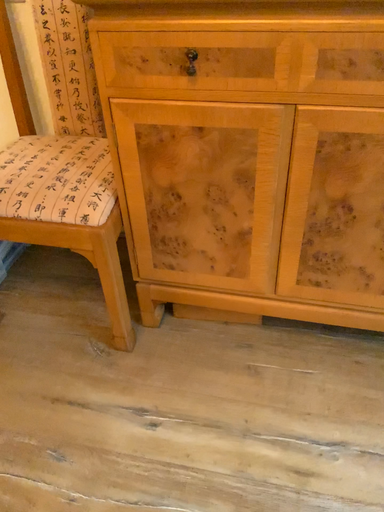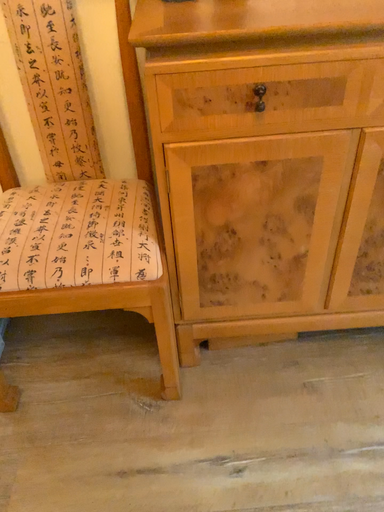
Question: How did the camera likely rotate when shooting the video?

Choices:
 (A) rotated right
 (B) rotated left

Answer: (A)